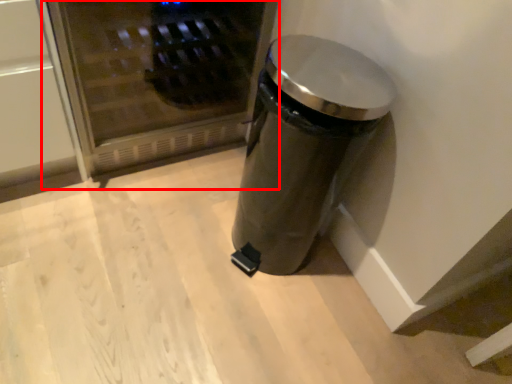
Question: From the image, what is the correct spatial relationship of microwave (annotated by the red box) in relation to waste container?

Choices:
 (A) right
 (B) left

Answer: (B)